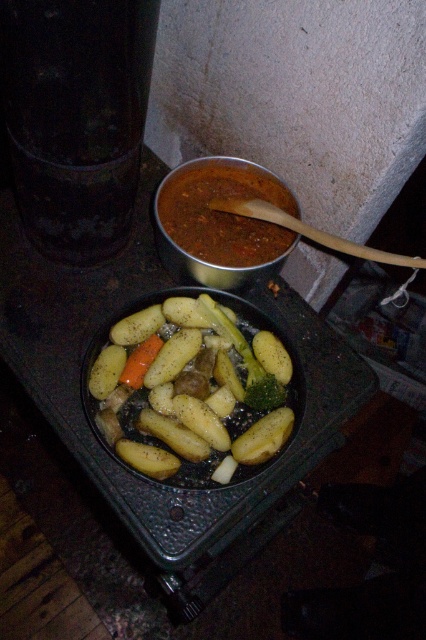
Looking at this image, what is located at the point with coordinates (192,390) in the image?

The point at coordinates (192,390) marks the location of smooth yellow potatoes at center.

You are a chef preparing a dish and need to know which ingredient occupies more space in the pan. Based on the image, which object has a greater width between the smooth yellow potatoes at center and the green matte broccoli at center?

The smooth yellow potatoes at center has a greater width than the green matte broccoli at center according to the description.

You are a chef standing in front of the rustic cooking setup. You need to reach for the smooth yellow potatoes at center. Considering your arm can only extend 80 centimeters, can you comfortably reach them?

The smooth yellow potatoes at center are 91.34 centimeters away from the viewer. Since your arm can only extend 80 centimeters, you cannot comfortably reach them without moving closer.